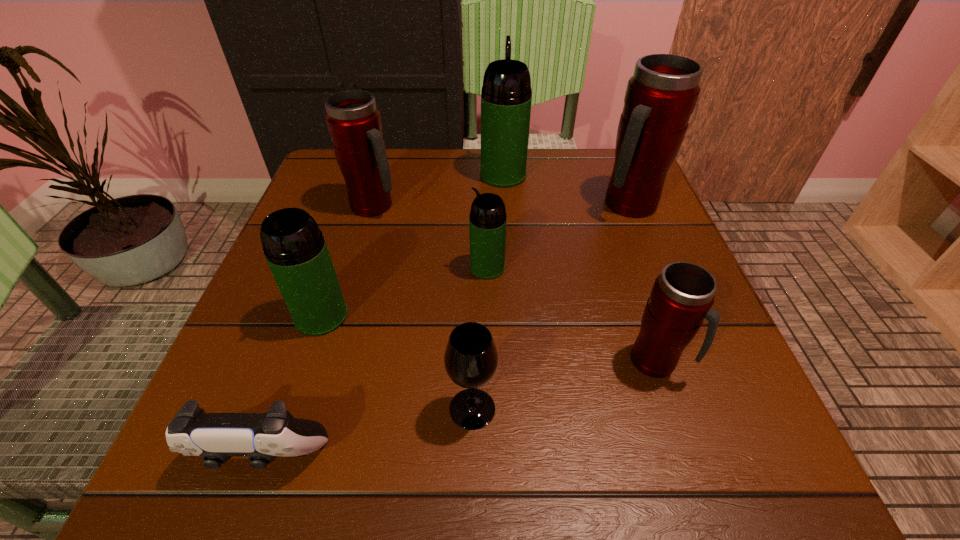
Locate an element on the screen. The width and height of the screenshot is (960, 540). vacant space that satisfies the following two spatial constraints: 1. on the side with the handle of the biggest red thermos bottle; 2. on the side with the handle of the leftmost red thermos bottle is located at coordinates (630, 206).

Where is `vacant area in the image that satisfies the following two spatial constraints: 1. on the side with the handle of the biggest red thermos bottle; 2. from the spout of the second nearest green thermos bottle`? This screenshot has width=960, height=540. vacant area in the image that satisfies the following two spatial constraints: 1. on the side with the handle of the biggest red thermos bottle; 2. from the spout of the second nearest green thermos bottle is located at coordinates (654, 267).